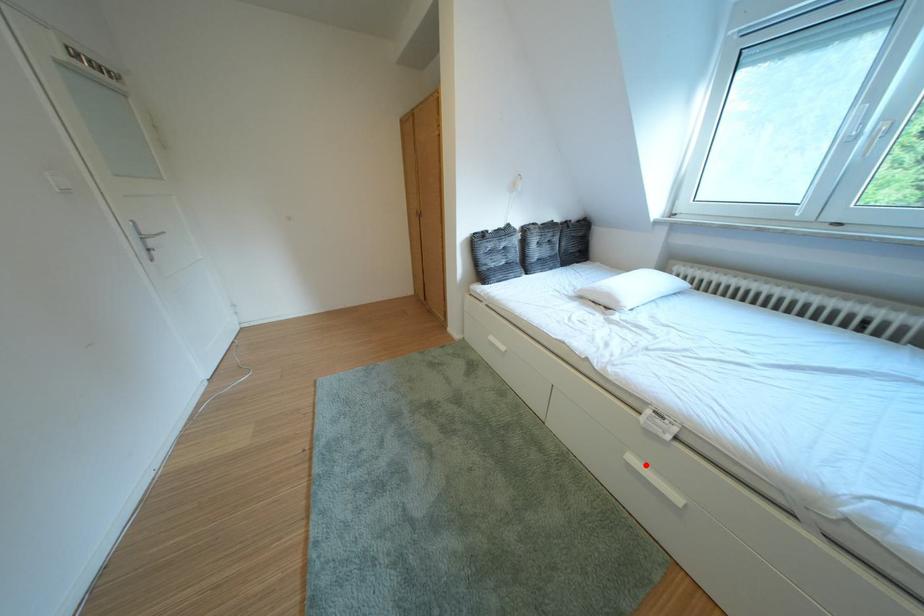
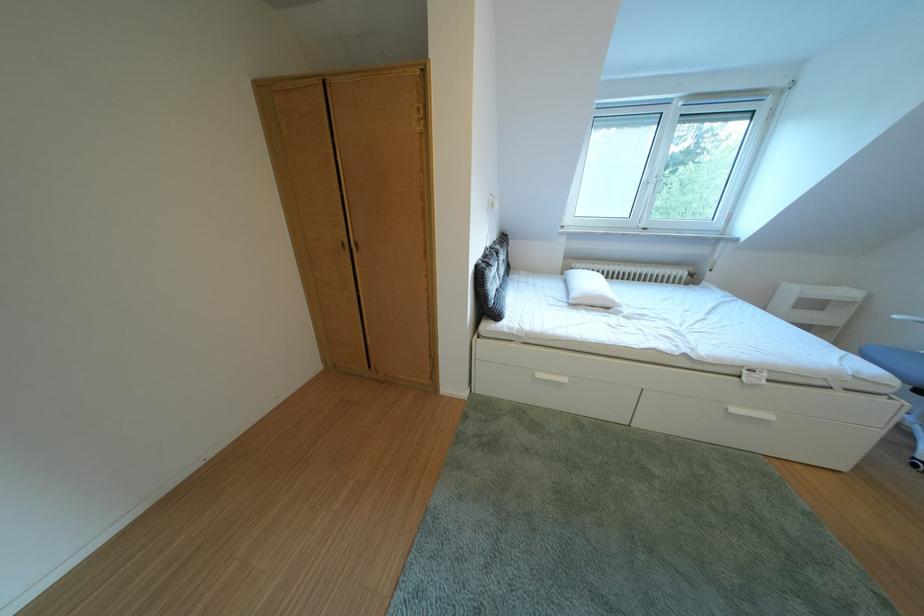
The point at the highlighted location is marked in the first image. Where is the corresponding point in the second image?

(748, 415)